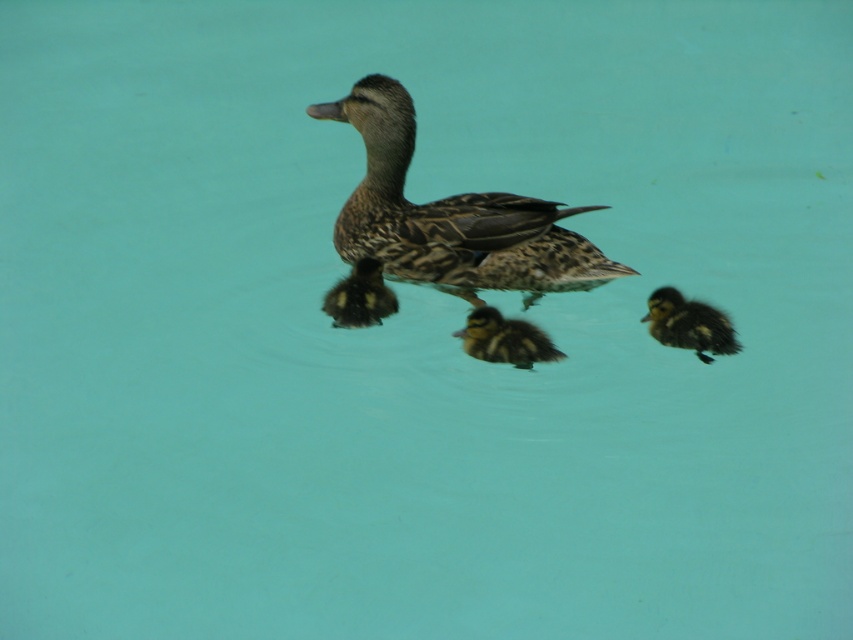
You are standing at the edge of the water and want to throw a small pebble to hit the point marked at coordinates point (498, 320). If your throwing distance is limited to 2.0 meters, will you be able to reach that point?

The distance of point (498, 320) from the camera is 2.20 meters, which is beyond your throwing range of 2.0 meters. Therefore, you cannot reach the point with your current throwing distance.

In the serene scene of the duck and her ducklings, where is the brown fluffy duckling at center relative to the soft brown downy duckling at center?

The brown fluffy duckling at center is located below the soft brown downy duckling at center.